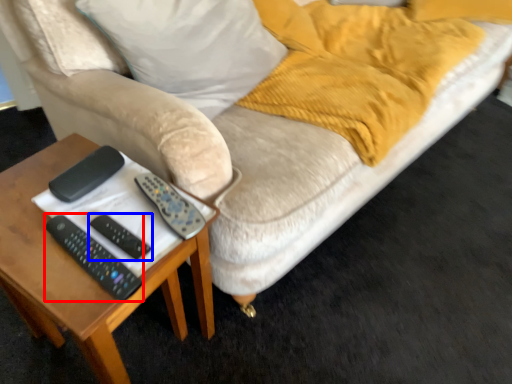
Question: Which object is further to the camera taking this photo, remote (highlighted by a red box) or remote (highlighted by a blue box)?

Choices:
 (A) remote
 (B) remote

Answer: (B)